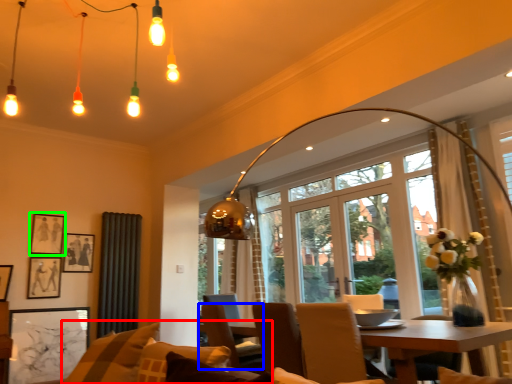
Question: Which object is the closest to the couch (highlighted by a red box)? Choose among these: chair (highlighted by a blue box) or picture frame (highlighted by a green box).

Choices:
 (A) chair
 (B) picture frame

Answer: (A)